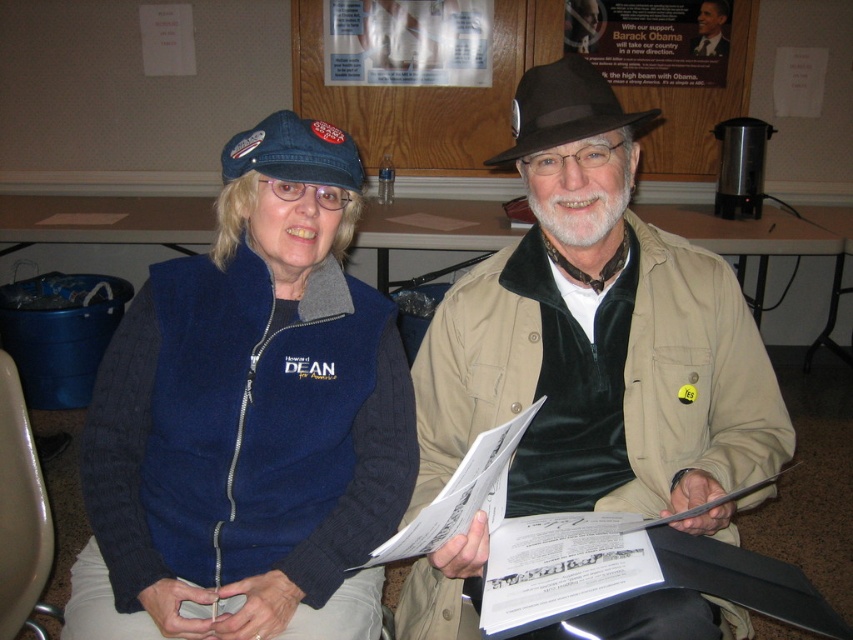
You are a photographer holding a camera. You want to take a photo of the brown felt hat at center without moving the camera. Is the hat within the camera lens range? The camera can focus on objects within 40 inches.

The brown felt hat at center and camera are 38.63 inches apart, which is within the camera lens range of 40 inches. Therefore, the hat is within the focus range and can be captured clearly.

You are a photographer at a political event. You need to capture a clear shot of both the brown felt hat at center and the denim cap at upper left. Which hat should you focus on first if you want to ensure the taller one is in focus?

The brown felt hat at center is much taller than the denim cap at upper left, so you should focus on the brown felt hat at center first to ensure it is in focus.